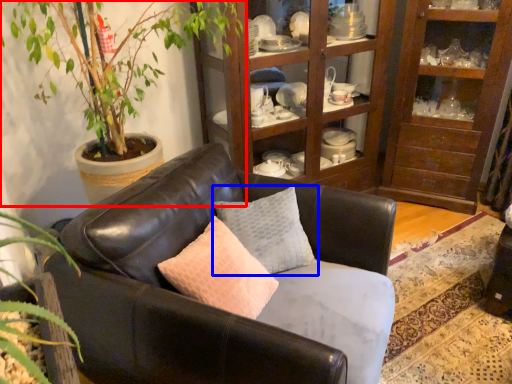
Question: Which object is closer to the camera taking this photo, houseplant (highlighted by a red box) or pillow (highlighted by a blue box)?

Choices:
 (A) houseplant
 (B) pillow

Answer: (A)